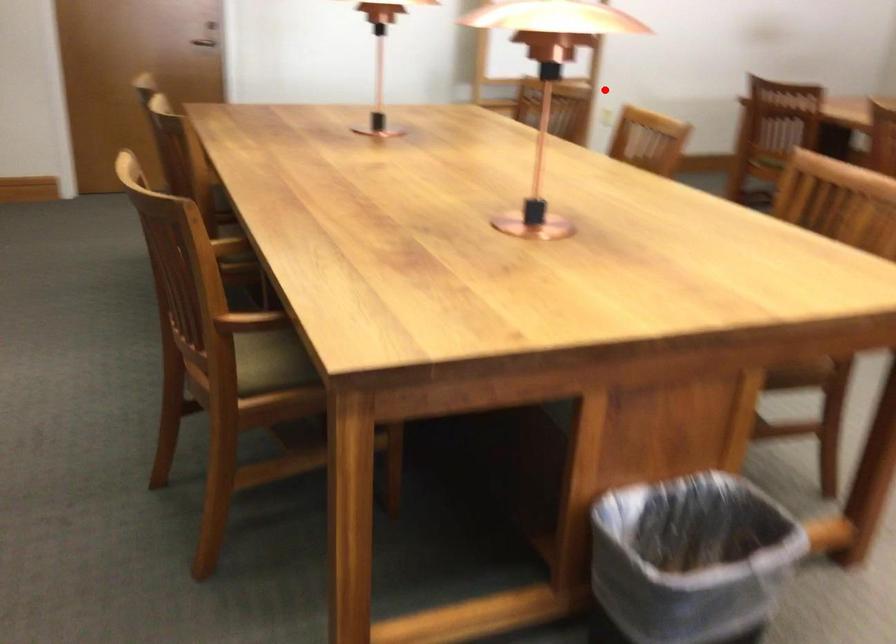
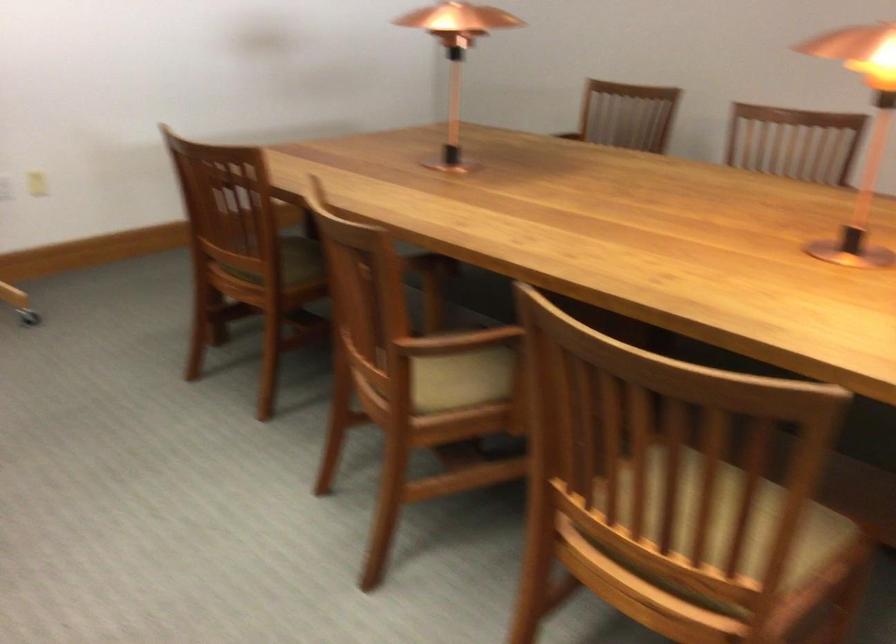
In the second image, find the point that corresponds to the highlighted location in the first image.

(37, 184)